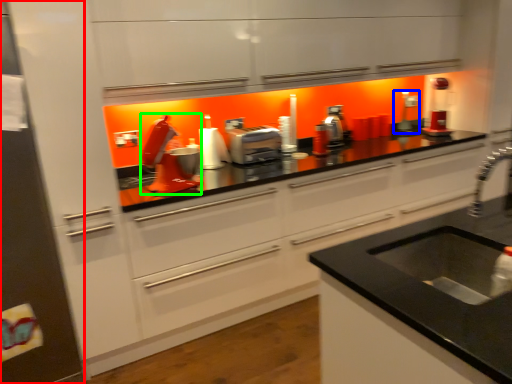
Question: Considering the real-world distances, which object is closest to fridge (highlighted by a red box)? appliance (highlighted by a blue box) or appliance (highlighted by a green box).

Choices:
 (A) appliance
 (B) appliance

Answer: (B)